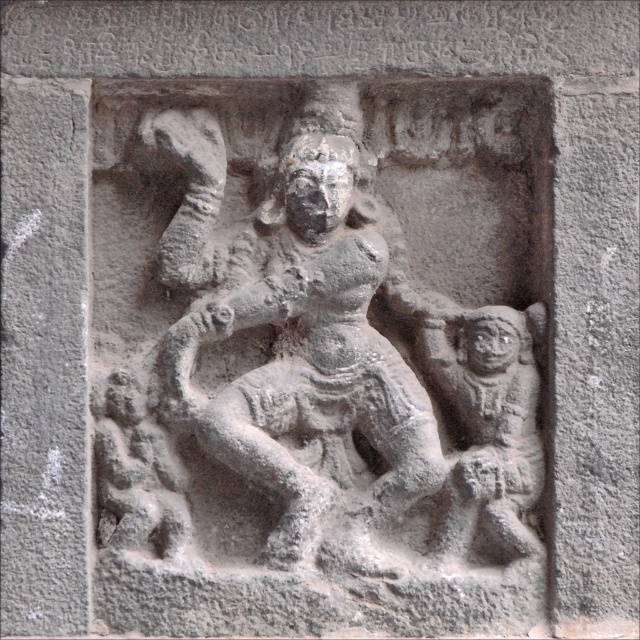
Question: Which object appears closest to the camera in this image?

Choices:
 (A) gray stone sculpture at center
 (B) gray stone monkey at right

Answer: (A)

Question: Is gray stone sculpture at center to the right of gray stone monkey at right from the viewer's perspective?

Choices:
 (A) yes
 (B) no

Answer: (B)

Question: Observing the image, what is the correct spatial positioning of gray stone sculpture at center in reference to gray stone monkey at right?

Choices:
 (A) below
 (B) above

Answer: (B)

Question: Among these points, which one is farthest from the camera?

Choices:
 (A) (429, 348)
 (B) (458, 467)

Answer: (A)

Question: Among these objects, which one is nearest to the camera?

Choices:
 (A) gray stone sculpture at center
 (B) gray stone monkey at right

Answer: (A)

Question: Does gray stone sculpture at center appear under gray stone monkey at right?

Choices:
 (A) yes
 (B) no

Answer: (B)